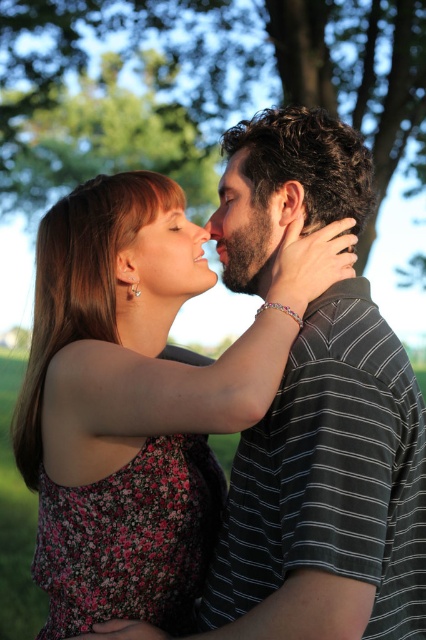
Question: Which point is closer to the camera?

Choices:
 (A) (40, 180)
 (B) (264, 282)
 (C) (249, 150)
 (D) (164, 253)

Answer: (B)

Question: Can you confirm if matte skin at center is wider than matte brown hair at upper center?

Choices:
 (A) yes
 (B) no

Answer: (A)

Question: Does matte skin at center appear over matte brown hair at upper center?

Choices:
 (A) yes
 (B) no

Answer: (B)

Question: Considering the real-world distances, which object is closest to the bearded man at center?

Choices:
 (A) matte skin at center
 (B) green leafy tree at upper center
 (C) matte brown hair at upper center

Answer: (C)

Question: Which object is positioned closest to the matte skin at center?

Choices:
 (A) bearded man at center
 (B) green leafy tree at upper center
 (C) matte brown hair at upper center

Answer: (A)

Question: Is bearded man at center to the right of matte brown hair at upper center from the viewer's perspective?

Choices:
 (A) no
 (B) yes

Answer: (B)